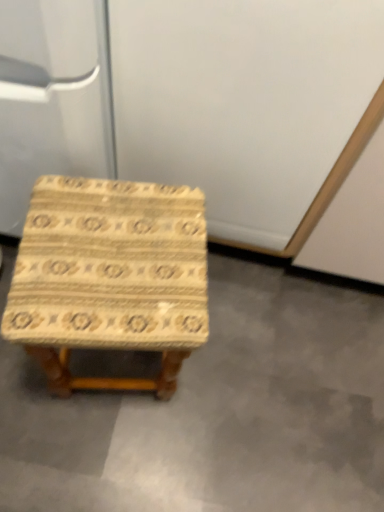
The height and width of the screenshot is (512, 384). Find the location of `empty space that is ontop of wooden-patterned stool at center`. empty space that is ontop of wooden-patterned stool at center is located at coordinates (114, 256).